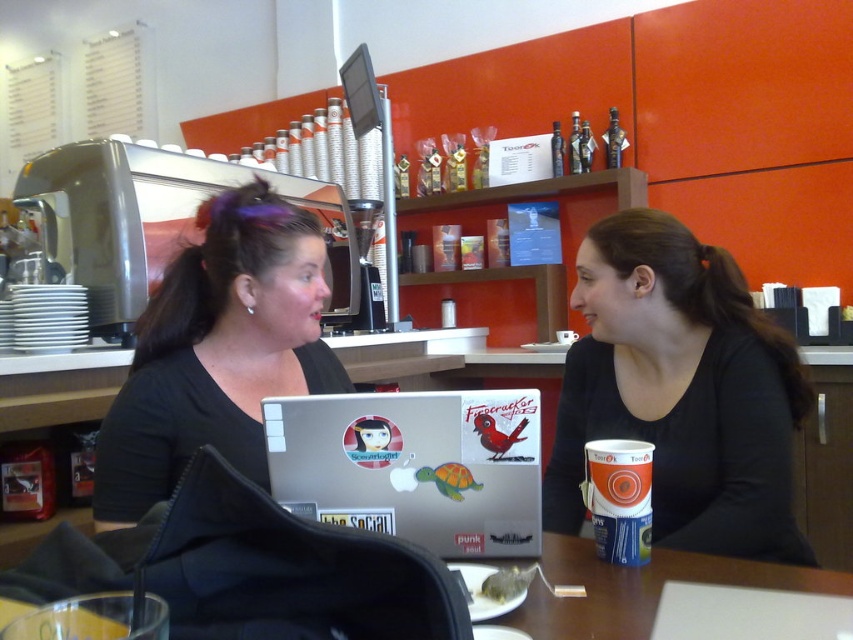
Does point (163, 342) come closer to viewer compared to point (558, 566)?

No, (163, 342) is further to viewer.

Is matte black laptop at center above brown wooden table at lower center?

Yes.

Identify the location of matte black laptop at center. The height and width of the screenshot is (640, 853). (218, 349).

Where is `matte black laptop at center`? matte black laptop at center is located at coordinates (218, 349).

This screenshot has width=853, height=640. Find the location of `black matte shirt at center`. black matte shirt at center is located at coordinates (682, 392).

In the scene shown: Does black matte shirt at center appear on the left side of orange matte cup at center?

No, black matte shirt at center is not to the left of orange matte cup at center.

Identify the location of black matte shirt at center. (682, 392).

Is silver metallic laptop at center further to the viewer compared to brown wooden table at lower center?

Yes, it is behind brown wooden table at lower center.

From the picture: Is silver metallic laptop at center wider than brown wooden table at lower center?

No.

Is point (369, 528) more distant than point (595, 621)?

Yes, it is behind point (595, 621).

Identify the location of silver metallic laptop at center. (415, 467).